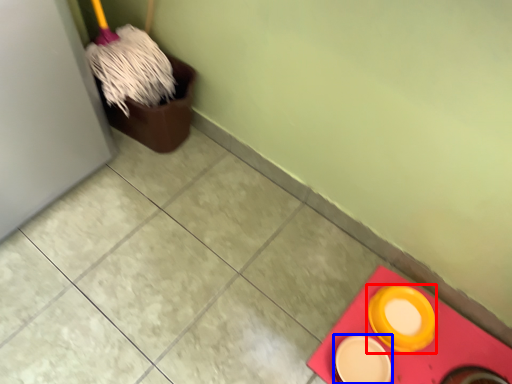
Question: Which of the following is the farthest to the observer, tableware (highlighted by a red box) or tableware (highlighted by a blue box)?

Choices:
 (A) tableware
 (B) tableware

Answer: (A)